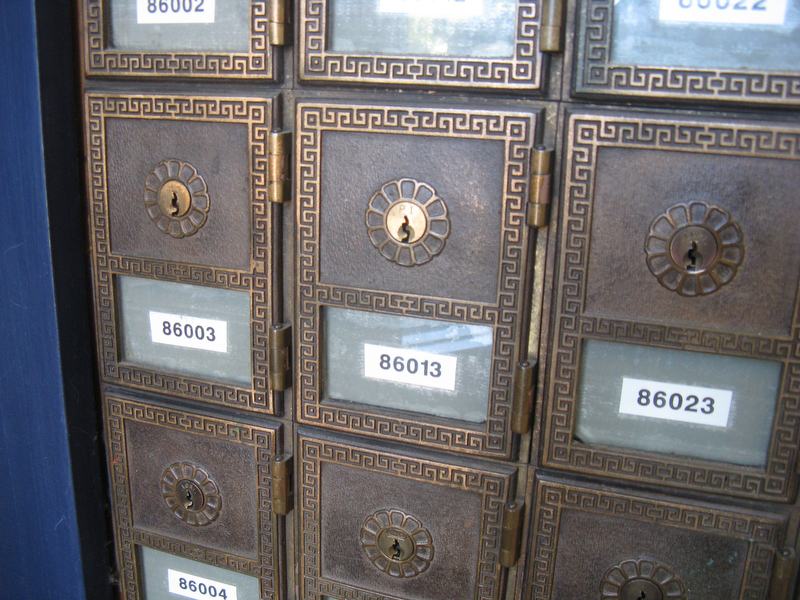
Find the location of a particular element. wall is located at coordinates point(37,344).